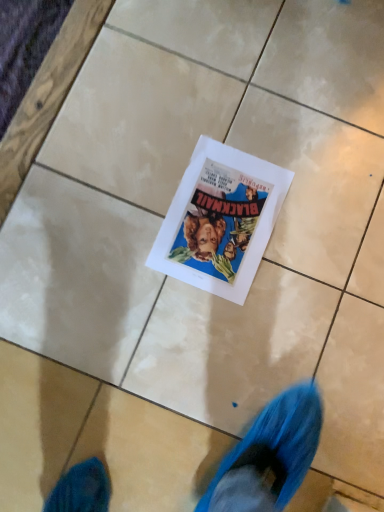
You are a GUI agent. You are given a task and a screenshot of the screen. Output one action in this format:
    pyautogui.click(x=<x>, y=<y>)
    Task: Click on the free location to the right of matte paper poster at center
    
    Given the screenshot: What is the action you would take?
    pyautogui.click(x=322, y=251)